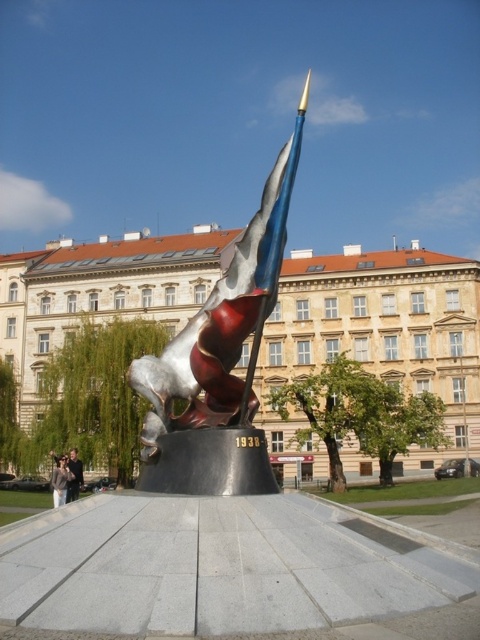
Question: Among these objects, which one is farthest from the camera?

Choices:
 (A) metallic building at center
 (B) metallic sculpture at center
 (C) dark blue jeans at lower left

Answer: (C)

Question: Which object is positioned closest to the light brown leather jacket at lower left?

Choices:
 (A) metallic sculpture at center
 (B) dark blue jeans at lower left

Answer: (B)

Question: Can you confirm if metallic building at center is positioned to the right of metallic sculpture at center?

Choices:
 (A) yes
 (B) no

Answer: (B)

Question: Which of the following is the closest to the observer?

Choices:
 (A) dark blue jeans at lower left
 (B) metallic sculpture at center
 (C) light brown leather jacket at lower left
 (D) metallic building at center

Answer: (B)

Question: Where is metallic building at center located in relation to dark blue jeans at lower left in the image?

Choices:
 (A) above
 (B) below

Answer: (A)

Question: Can you confirm if metallic sculpture at center is positioned below light brown leather jacket at lower left?

Choices:
 (A) no
 (B) yes

Answer: (A)